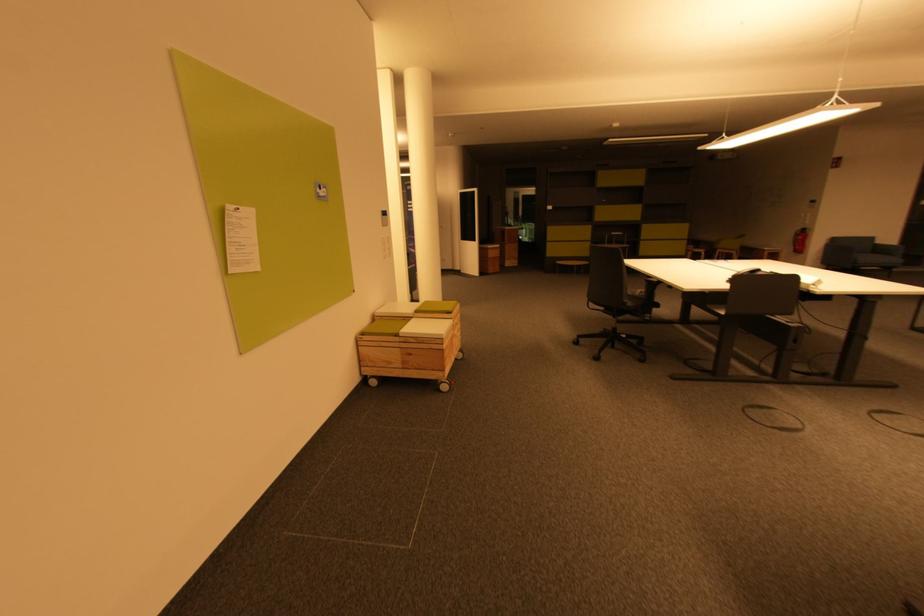
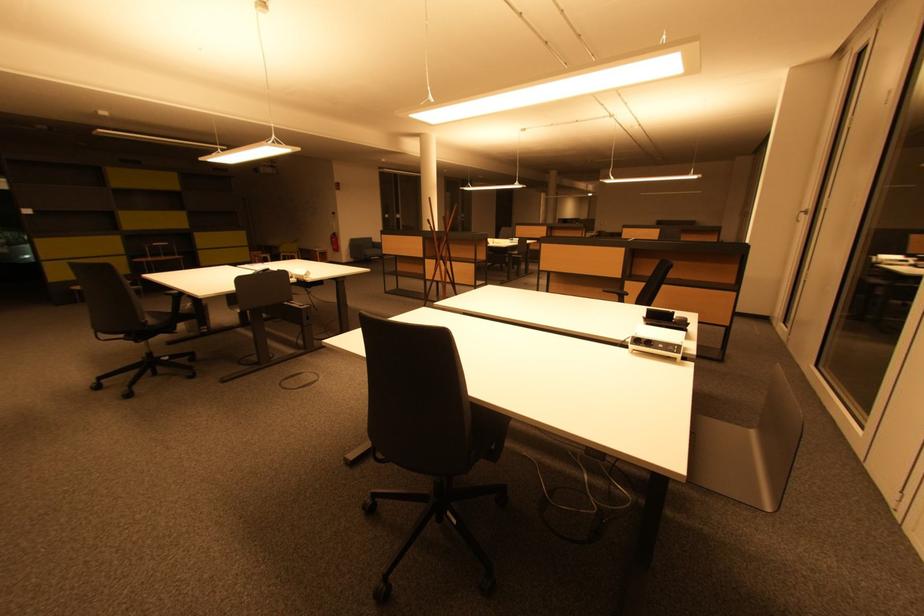
The point at (805,240) is marked in the first image. Where is the corresponding point in the second image?

(338, 241)